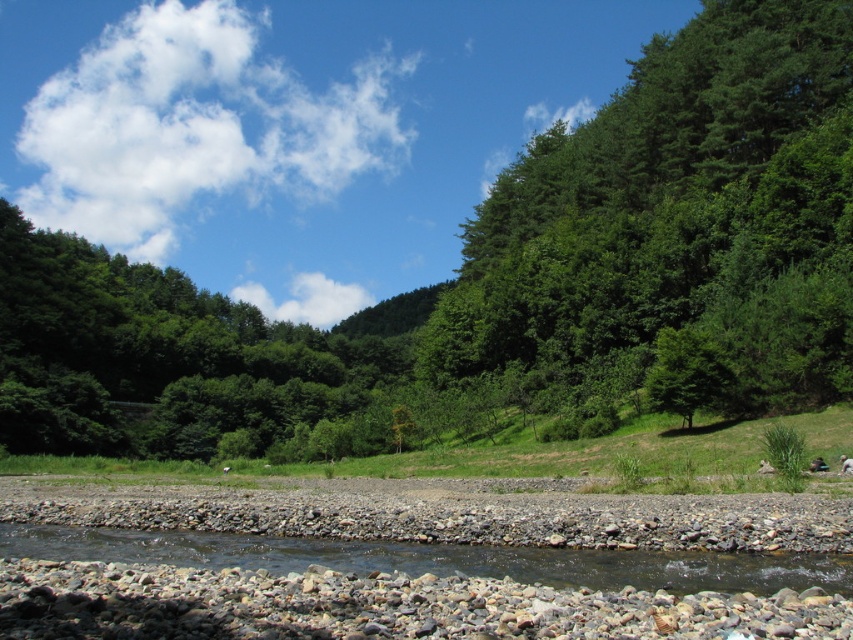
You are standing at the edge of the riverbank in the scene. You want to walk towards the green leafy forest at center. Which direction should you move in?

You should move towards the center of the scene to reach the green leafy forest at center, which is located at point coordinates approximately 0.436 along the x axis and 0.589 along the y axis.